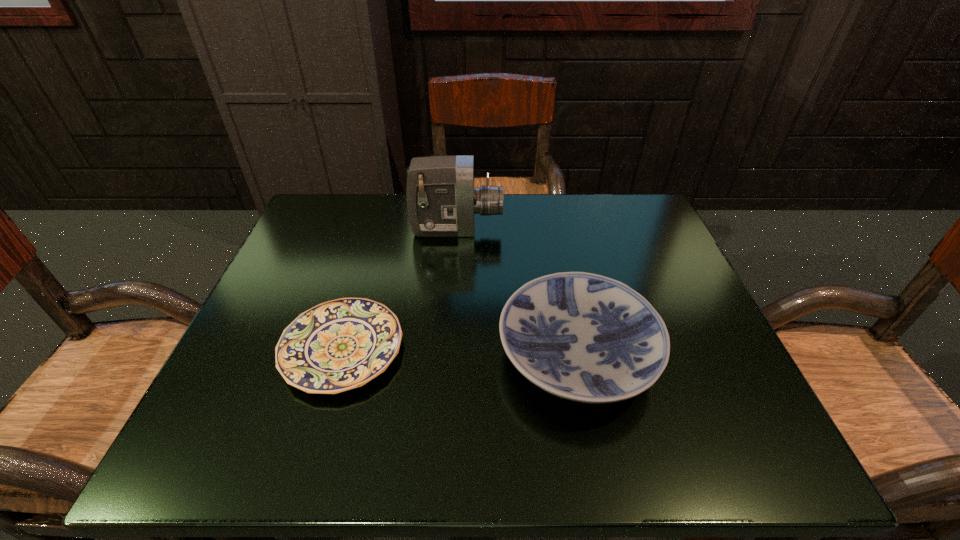
In order to click on vacant region at the near right corner of the desktop in this screenshot , I will do `click(747, 462)`.

Image resolution: width=960 pixels, height=540 pixels. I want to click on vacant area between the shortest object and the tallest object, so click(399, 289).

Image resolution: width=960 pixels, height=540 pixels. In order to click on the second closest object to the farthest object in this screenshot , I will do `click(339, 345)`.

Point out which object is positioned as the second nearest to the shorter plate. Please provide its 2D coordinates. Your answer should be formatted as a tuple, i.e. [(x, y)], where the tuple contains the x and y coordinates of a point satisfying the conditions above.

[(441, 199)]

The image size is (960, 540). Identify the location of free space that satisfies the following two spatial constraints: 1. at the front of the camcorder, highlighting the lens; 2. on the left side of the taller plate. (448, 354).

Identify the location of free space that satisfies the following two spatial constraints: 1. on the back side of the taller plate; 2. at the front of the farthest object, highlighting the lens. (552, 230).

What are the coordinates of `free space that satisfies the following two spatial constraints: 1. at the front of the right plate, highlighting the lens; 2. on the left side of the tallest object` in the screenshot? It's located at (448, 354).

This screenshot has height=540, width=960. Find the location of `free space that satisfies the following two spatial constraints: 1. at the front of the taller plate, highlighting the lens; 2. on the right side of the tallest object`. free space that satisfies the following two spatial constraints: 1. at the front of the taller plate, highlighting the lens; 2. on the right side of the tallest object is located at coordinates click(x=448, y=354).

Locate an element on the screen. This screenshot has width=960, height=540. vacant space that satisfies the following two spatial constraints: 1. at the front of the second tallest object, highlighting the lens; 2. on the right side of the farthest object is located at coordinates [448, 354].